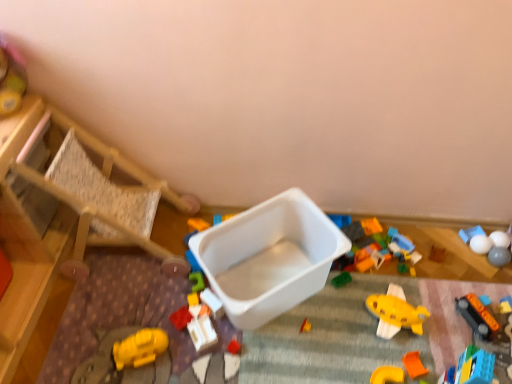
I want to click on unoccupied region to the right of orange matte plastic toy at lower right, which is counted as the 5th toy, starting from the left, so click(x=426, y=354).